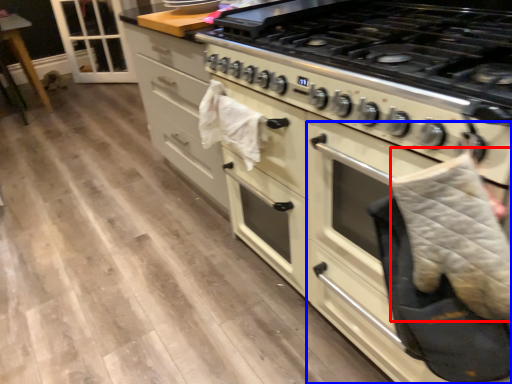
Question: Which object is closer to the camera taking this photo, blanket (highlighted by a red box) or oven (highlighted by a blue box)?

Choices:
 (A) blanket
 (B) oven

Answer: (B)